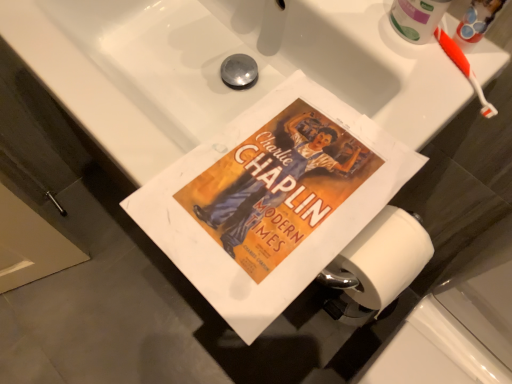
Locate an element on the screen. The width and height of the screenshot is (512, 384). free space above matte paper poster at center (from a real-world perspective) is located at coordinates (278, 175).